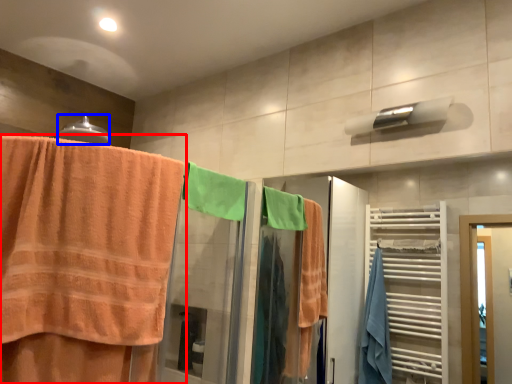
Question: Which object appears closest to the camera in this image, towel (highlighted by a red box) or towel bar (highlighted by a blue box)?

Choices:
 (A) towel
 (B) towel bar

Answer: (A)